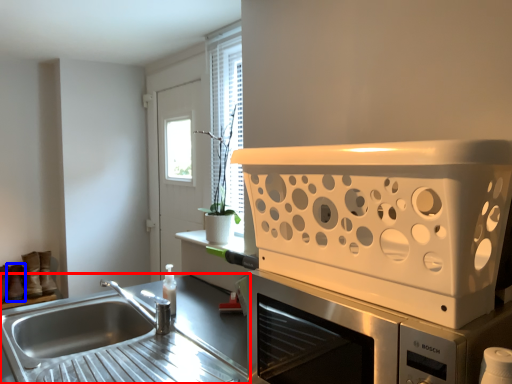
Question: Which of the following is the farthest to the observer, countertop (highlighted by a red box) or shoe (highlighted by a blue box)?

Choices:
 (A) countertop
 (B) shoe

Answer: (B)